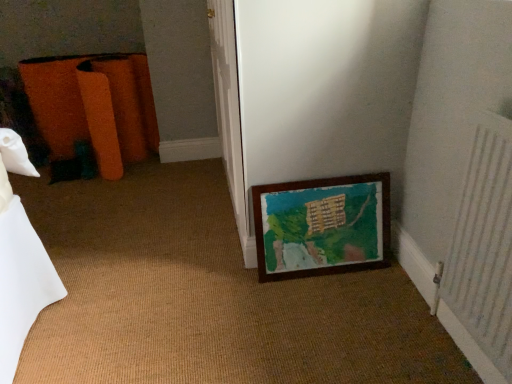
Find the location of a particular element. Image resolution: width=512 pixels, height=384 pixels. vacant area that lies between white textured radiator at right and orange fabric bag at left is located at coordinates (197, 235).